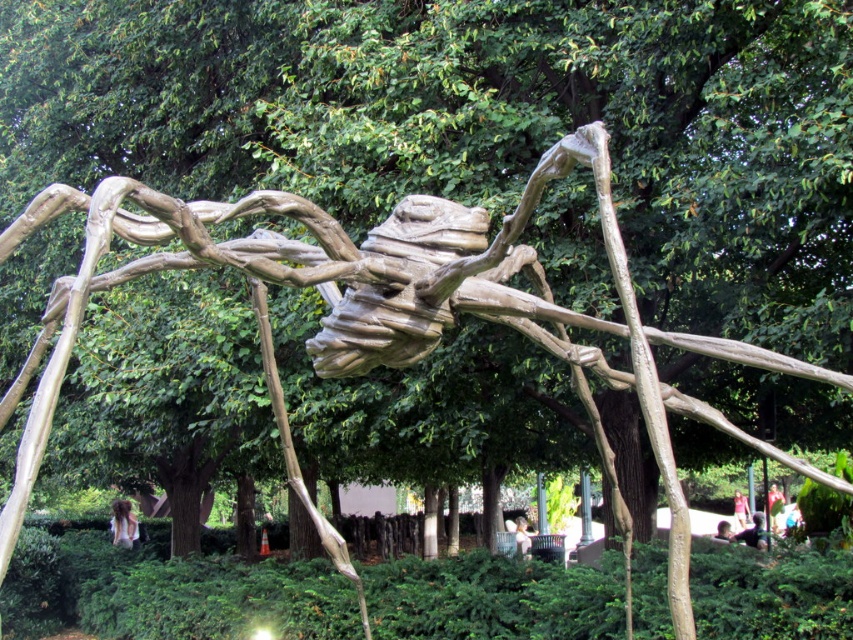
Can you confirm if brown hair at lower left is thinner than white fabric person at center?

In fact, brown hair at lower left might be wider than white fabric person at center.

Between point (114, 509) and point (526, 550), which one is positioned behind?

The point (114, 509) is behind.

Locate an element on the screen. The width and height of the screenshot is (853, 640). brown hair at lower left is located at coordinates (123, 524).

Is the position of white fabric person at center more distant than that of yellow fabric dress at center?

No, white fabric person at center is in front of yellow fabric dress at center.

Which is above, white fabric person at center or yellow fabric dress at center?

Positioned higher is yellow fabric dress at center.

In the scene shown: Measure the distance between point (523, 554) and camera.

Point (523, 554) is 12.01 meters away from camera.

You are a GUI agent. You are given a task and a screenshot of the screen. Output one action in this format:
    pyautogui.click(x=<x>, y=<y>)
    Task: Click on the white fabric person at center
    
    Given the screenshot: What is the action you would take?
    pyautogui.click(x=521, y=536)

Does brown hair at lower left have a lesser height compared to dark brown hair at lower right?

Yes.

Can you confirm if brown hair at lower left is bigger than dark brown hair at lower right?

Indeed, brown hair at lower left has a larger size compared to dark brown hair at lower right.

Where is `brown hair at lower left`? This screenshot has width=853, height=640. brown hair at lower left is located at coordinates (123, 524).